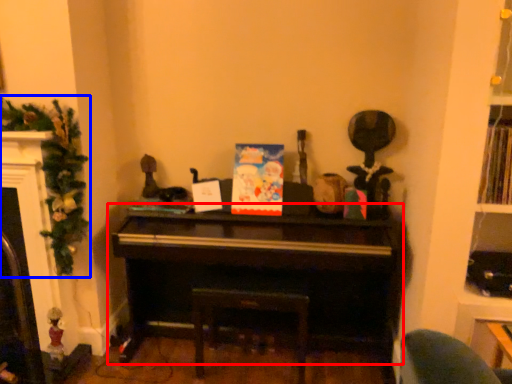
Question: Among these objects, which one is farthest to the camera, piano (highlighted by a red box) or christmas decoration (highlighted by a blue box)?

Choices:
 (A) piano
 (B) christmas decoration

Answer: (A)